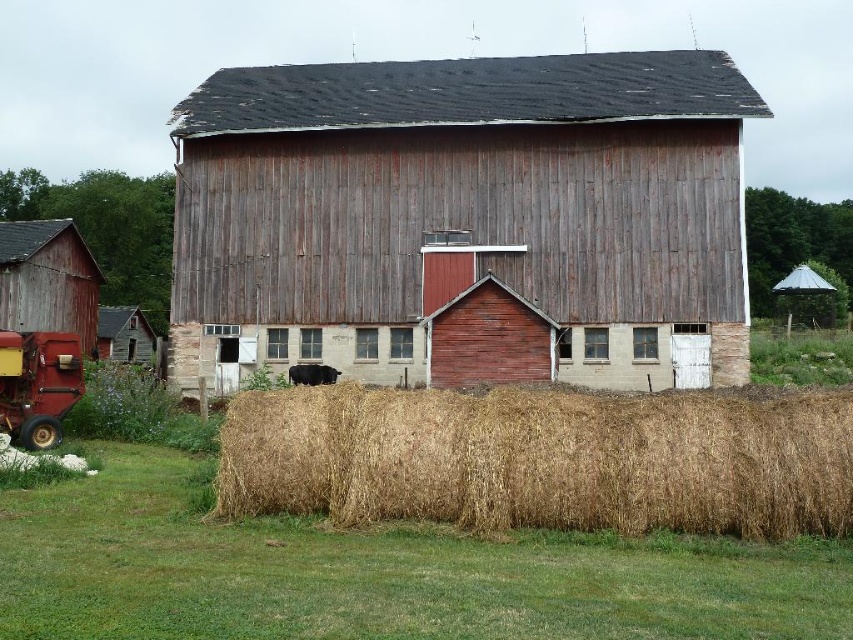
Question: Considering the relative positions of wooden barn at center and metallic red tractor at lower left in the image provided, where is wooden barn at center located with respect to metallic red tractor at lower left?

Choices:
 (A) below
 (B) above

Answer: (B)

Question: Does rustic wood barn at left appear over metallic red tractor at lower left?

Choices:
 (A) yes
 (B) no

Answer: (A)

Question: Among these objects, which one is farthest from the camera?

Choices:
 (A) rustic wood barn at left
 (B) brown straw bales at lower center
 (C) wooden barn at center

Answer: (A)

Question: Which of the following is the closest to the observer?

Choices:
 (A) brown straw bales at lower center
 (B) rustic wood barn at left
 (C) wooden barn at center

Answer: (A)

Question: Which point appears closest to the camera in this image?

Choices:
 (A) (637, 416)
 (B) (718, 300)

Answer: (A)

Question: Is wooden barn at center thinner than rustic wood barn at left?

Choices:
 (A) no
 (B) yes

Answer: (A)